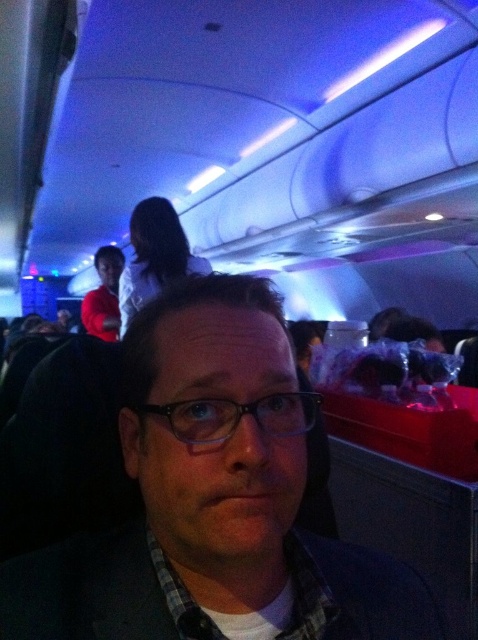
You are a flight attendant on an airplane. You need to hand out snacks to passengers. You see a matte black glasses at center and a matte red shirt at left. Which object is wider so you can decide where to place the snacks?

The matte black glasses at center is wider than the matte red shirt at left, so you should place the snacks near the matte black glasses at center.

You are a flight attendant checking the seating arrangement. You need to locate the matte black glasses at center. According to the coordinate system where the bottom left corner is the origin, can you confirm its position relative to the center of the image?

The matte black glasses at center is located at point coordinates approximately 0.780 on the x axis and 0.431 on the y axis. Since the center of the image would be at coordinates approximately 0.5 on both axes, this position indicates the glasses are to the right and slightly above the center point.

Looking at this image, you are a flight attendant trying to place a new tray of food on the table. The tray is exactly the same width as the matte red shirt at left. Can you fit the tray next to the black plastic glasses at center without moving the glasses?

The black plastic glasses at center has a lesser width compared to matte red shirt at left, so the tray, which is as wide as the matte red shirt at left, will not fit next to the black plastic glasses at center since it is wider than the available space.